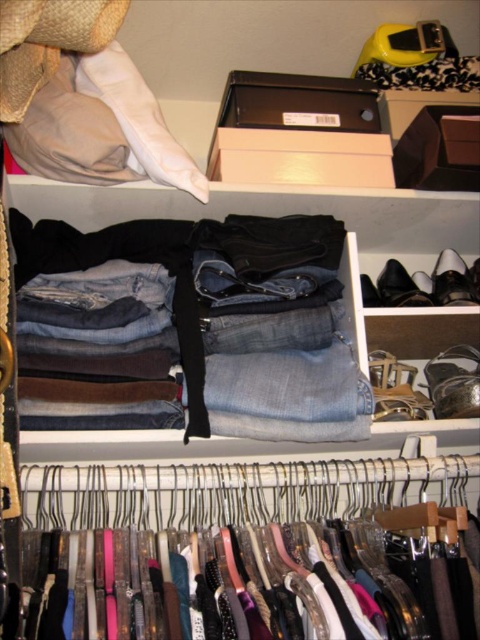
Can you confirm if metallic hangers at center is positioned below denim jeans at center?

Yes, metallic hangers at center is below denim jeans at center.

Which of these two, metallic hangers at center or denim jeans at center, stands taller?

denim jeans at center is taller.

Which is behind, point (383, 586) or point (57, 275)?

The point (57, 275) is more distant.

At what (x,y) coordinates should I click in order to perform the action: click on metallic hangers at center. Please return your answer as a coordinate pair (x, y). Looking at the image, I should click on (249, 540).